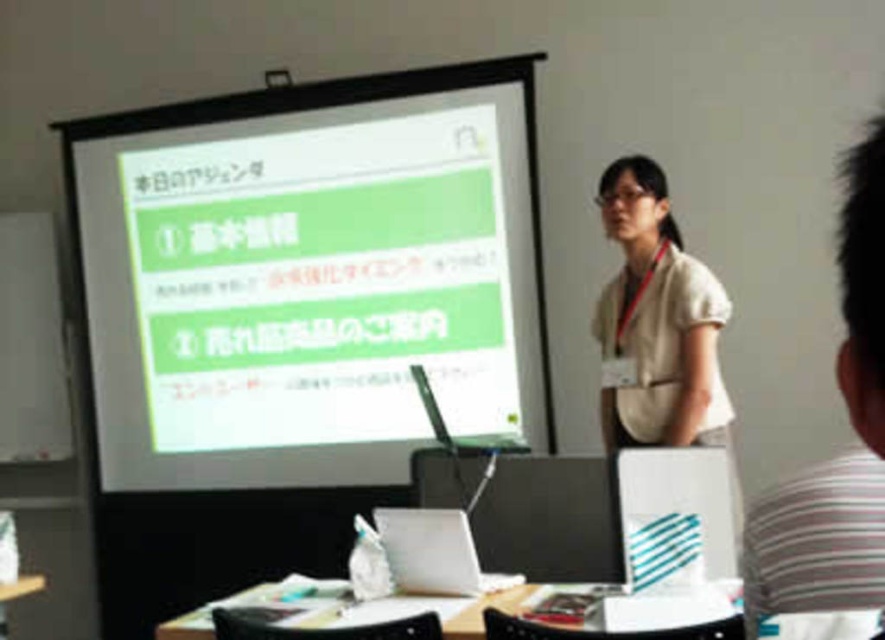
Who is lower down, striped cotton shirt at right or silver metallic laptop at center?

Positioned lower is silver metallic laptop at center.

Which is behind, point (855, 328) or point (420, 372)?

The point (420, 372) is more distant.

You are a GUI agent. You are given a task and a screenshot of the screen. Output one action in this format:
    pyautogui.click(x=<x>, y=<y>)
    Task: Click on the striped cotton shirt at right
    
    Given the screenshot: What is the action you would take?
    pyautogui.click(x=863, y=289)

Where is `striped cotton shirt at right`? This screenshot has height=640, width=885. striped cotton shirt at right is located at coordinates (863, 289).

Who is positioned more to the right, white matte laptop at center or wooden table at lower center?

Positioned to the right is wooden table at lower center.

Can you confirm if white matte laptop at center is smaller than wooden table at lower center?

Actually, white matte laptop at center might be larger than wooden table at lower center.

Where is `white matte laptop at center`? The image size is (885, 640). white matte laptop at center is located at coordinates (435, 552).

What are the coordinates of `white matte laptop at center` in the screenshot? It's located at (435, 552).

Does point (845, 582) come in front of point (541, 588)?

Yes.

Is point (783, 609) farther from camera compared to point (381, 600)?

No, (783, 609) is in front of (381, 600).

Identify the location of striped cotton shirt at right. (863, 289).